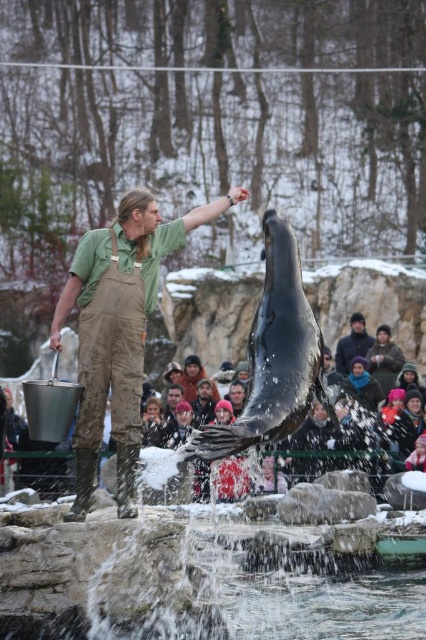
Does point (65, 296) come in front of point (339, 362)?

Yes.

Is point (80, 454) behind point (354, 324)?

No.

Image resolution: width=426 pixels, height=640 pixels. What do you see at coordinates (118, 330) in the screenshot? I see `green cotton shirt at center` at bounding box center [118, 330].

At what (x,y) coordinates should I click in order to perform the action: click on green cotton shirt at center. Please return your answer as a coordinate pair (x, y). The image size is (426, 640). Looking at the image, I should click on (118, 330).

Between matte brown fur at center and dark brown leather jacket at center, which one appears on the left side from the viewer's perspective?

matte brown fur at center

Who is more distant from viewer, (242, 365) or (353, 339)?

The point (242, 365) is more distant.

Image resolution: width=426 pixels, height=640 pixels. Identify the location of matte brown fur at center. (26, 374).

Is point (121, 508) positioned after point (71, 337)?

No, (121, 508) is closer to viewer.

Is point (127, 355) less distant than point (71, 333)?

Yes, point (127, 355) is closer to viewer.

Is point (131, 349) positioned in front of point (385, 326)?

That is True.

Locate an element on the screen. This screenshot has height=640, width=426. green cotton shirt at center is located at coordinates (118, 330).